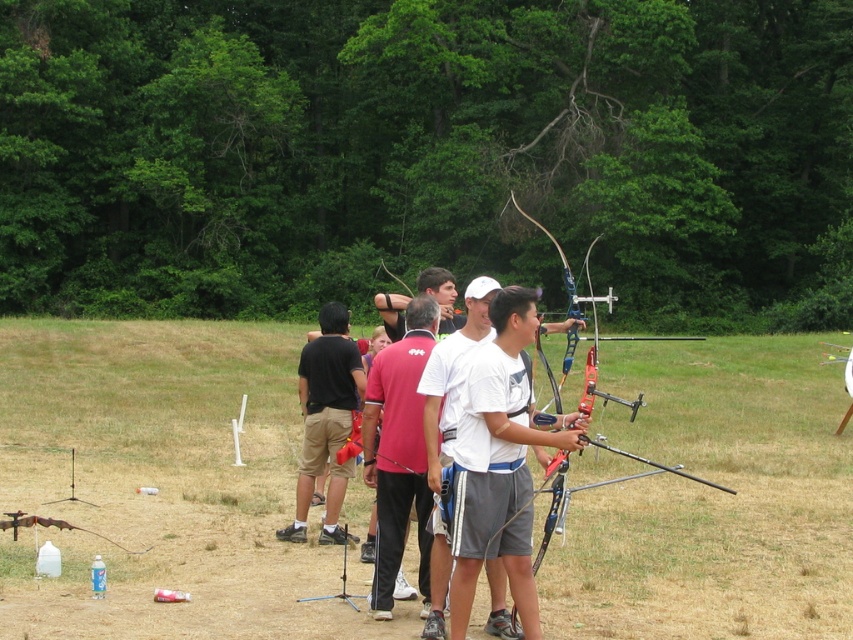
Between white matte shirt at center and matte blue bow at center, which one appears on the right side from the viewer's perspective?

Positioned to the right is matte blue bow at center.

Can you confirm if white matte shirt at center is taller than matte blue bow at center?

Incorrect, white matte shirt at center's height is not larger of matte blue bow at center's.

I want to click on white matte shirt at center, so click(500, 461).

The image size is (853, 640). I want to click on white matte shirt at center, so click(500, 461).

Is matte black shirt at center below matte blue bow at center?

Yes.

In the scene shown: Can you confirm if matte black shirt at center is wider than matte blue bow at center?

No.

This screenshot has height=640, width=853. In order to click on matte black shirt at center in this screenshot , I will do `click(325, 419)`.

This screenshot has width=853, height=640. What do you see at coordinates (161, 483) in the screenshot? I see `grassy field at center` at bounding box center [161, 483].

Between point (225, 522) and point (654, 467), which one is positioned in front?

Positioned in front is point (225, 522).

Between point (802, 506) and point (633, 454), which one is positioned behind?

Point (633, 454)

Locate an element on the screen. grassy field at center is located at coordinates (161, 483).